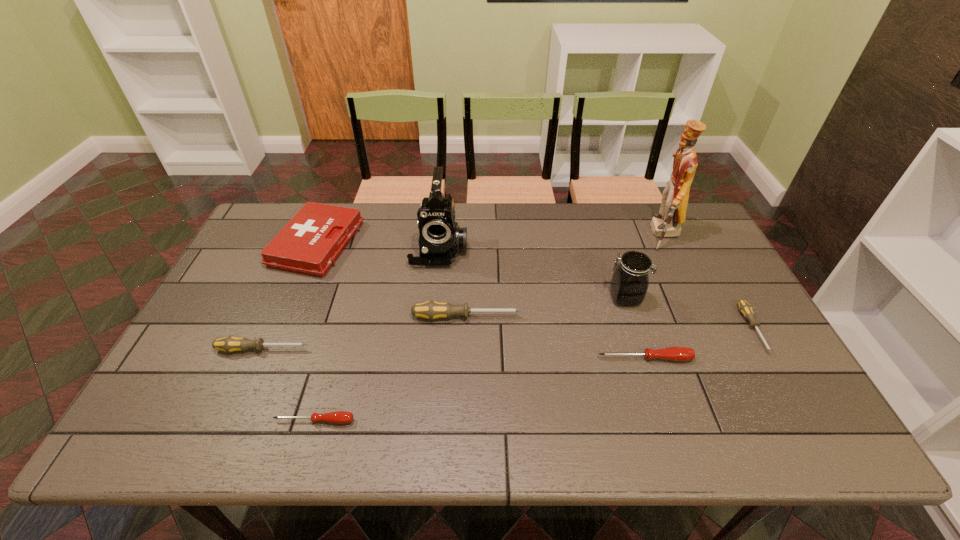
Locate an element on the screen. The height and width of the screenshot is (540, 960). the rightmost screwdriver is located at coordinates (746, 309).

Locate an element on the screen. This screenshot has height=540, width=960. the rightmost gray screwdriver is located at coordinates (746, 309).

Identify the location of the left red screwdriver. The width and height of the screenshot is (960, 540). (339, 417).

The height and width of the screenshot is (540, 960). I want to click on the nearer red screwdriver, so click(339, 417).

At what (x,y) coordinates should I click in order to perform the action: click on free location located on the front-facing side of the tallest object. Please return your answer as a coordinate pair (x, y). The image size is (960, 540). Looking at the image, I should click on coord(534,235).

Image resolution: width=960 pixels, height=540 pixels. What are the coordinates of `vacant space located 0.220m on the front-facing side of the tallest object` in the screenshot? It's located at (582, 235).

At what (x,y) coordinates should I click in order to perform the action: click on vacant region located on the front-facing side of the tallest object. Please return your answer as a coordinate pair (x, y). The image size is (960, 540). Looking at the image, I should click on (614, 235).

Find the location of a particular element. This screenshot has height=540, width=960. free space located on the lens mount of the camcorder is located at coordinates (435, 294).

At what (x,y) coordinates should I click in order to perform the action: click on vacant space situated on the lid of the jar. Please return your answer as a coordinate pair (x, y). This screenshot has width=960, height=540. Looking at the image, I should click on (474, 298).

Identify the location of vacant space located on the lid of the jar. (485, 298).